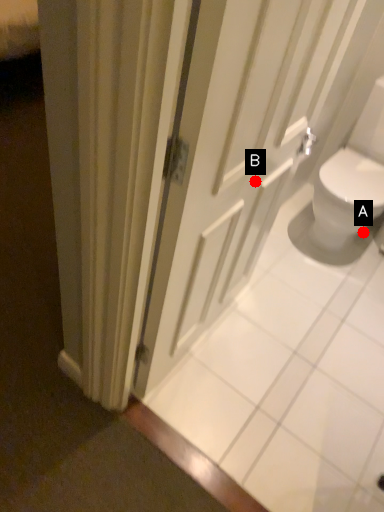
Question: Two points are circled on the image, labeled by A and B beside each circle. Which point is closer to the camera taking this photo?

Choices:
 (A) A is closer
 (B) B is closer

Answer: (B)